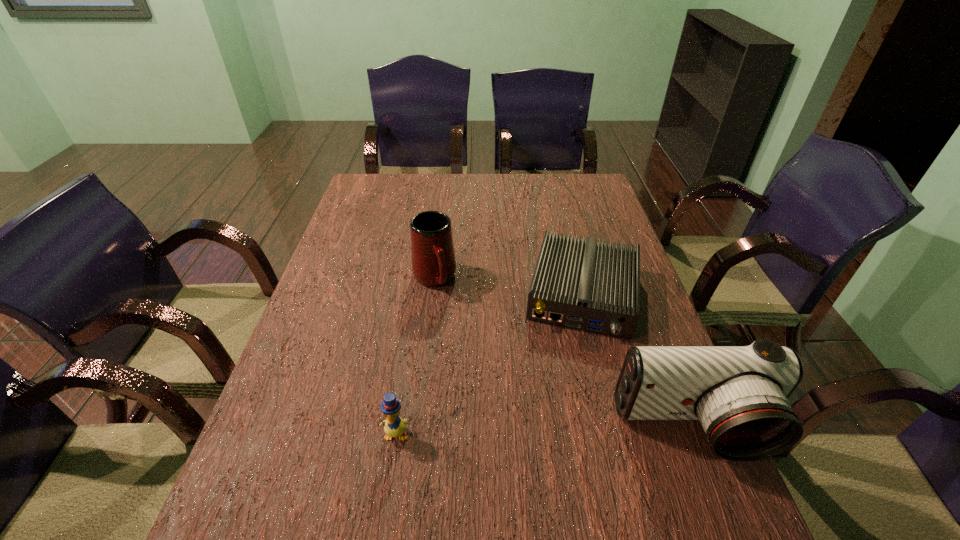
You are a GUI agent. You are given a task and a screenshot of the screen. Output one action in this format:
    pyautogui.click(x=<x>, y=<y>)
    Task: Click on the duckling
    The width and height of the screenshot is (960, 540).
    Given the screenshot: What is the action you would take?
    pyautogui.click(x=394, y=426)

Where is `camcorder`? The image size is (960, 540). camcorder is located at coordinates (740, 394).

I want to click on mug, so click(x=433, y=257).

I want to click on router, so click(587, 285).

The width and height of the screenshot is (960, 540). Find the location of `vacant space situated 0.050m on the face of the second shortest object, where the monocle is placed`. vacant space situated 0.050m on the face of the second shortest object, where the monocle is placed is located at coordinates (390, 469).

Identify the location of vacant space located on the side of the mug with the handle. This screenshot has width=960, height=540. (468, 360).

Image resolution: width=960 pixels, height=540 pixels. I want to click on vacant area located 0.180m on the side of the mug with the handle, so click(x=461, y=345).

You are a GUI agent. You are given a task and a screenshot of the screen. Output one action in this format:
    pyautogui.click(x=<x>, y=<y>)
    Task: Click on the vacant area located 0.120m on the side of the mug with the handle
    This screenshot has height=540, width=960.
    Given the screenshot: What is the action you would take?
    pyautogui.click(x=454, y=328)

Find the location of `free space located 0.170m on the back panel of the router`. free space located 0.170m on the back panel of the router is located at coordinates (568, 398).

In order to click on vacant region located on the back panel of the router in this screenshot , I will do `click(569, 394)`.